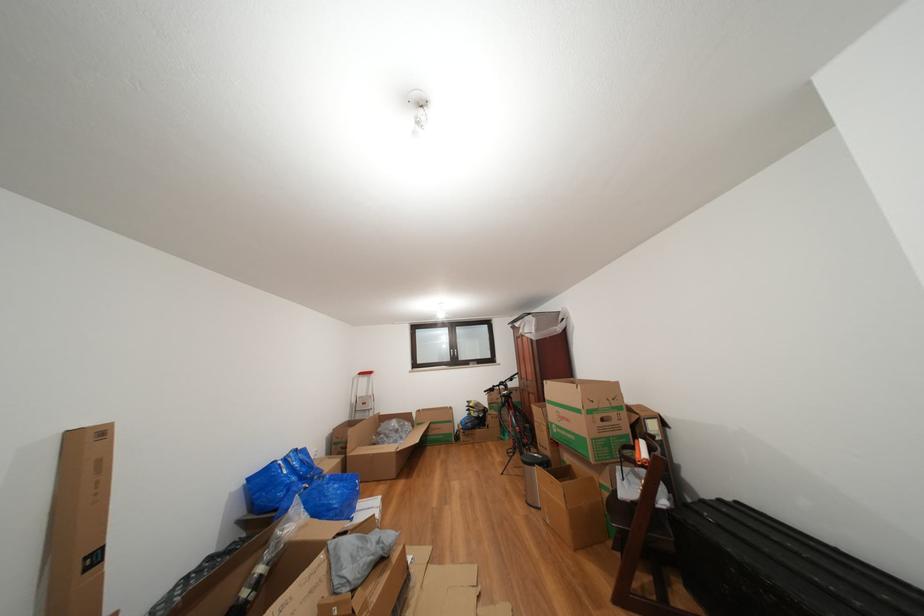
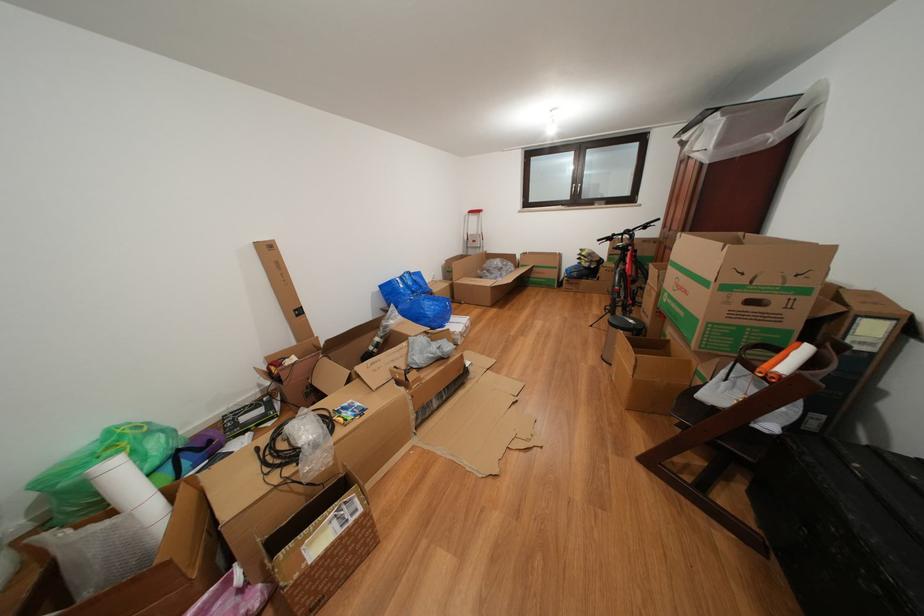
Locate, in the second image, the point that corresponds to [456,365] in the first image.

(576, 203)